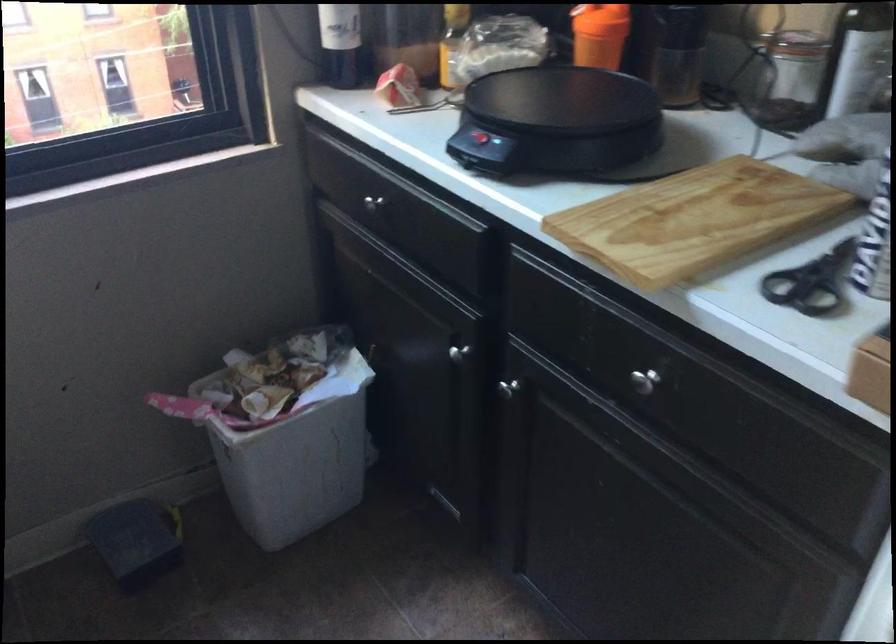
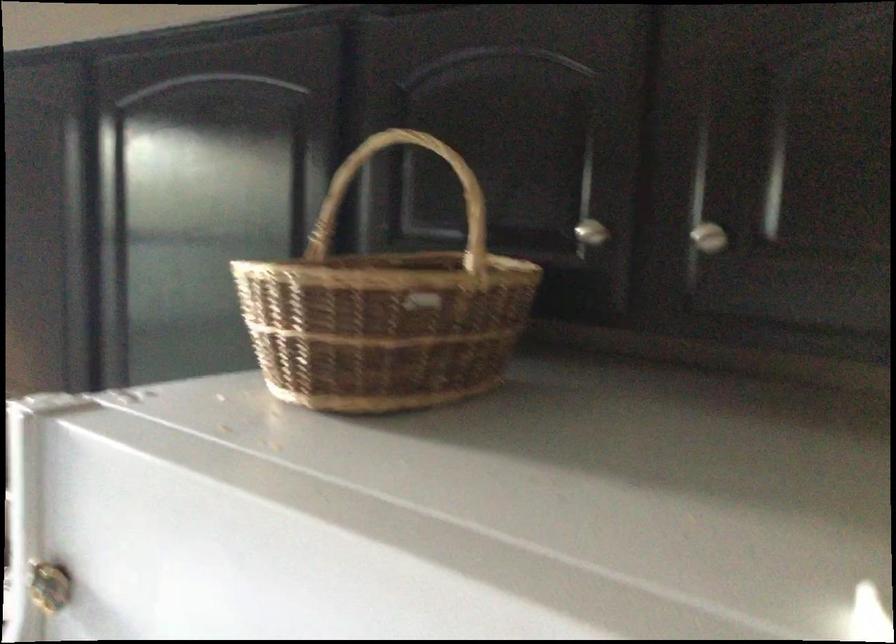
Question: I am providing you with two images of the same scene from different viewpoints. After the viewpoint changes to image2, which objects are now occluded?

Choices:
 (A) silver cabinet knob
 (B) white net hammock
 (C) orange shaker bottle
 (D) wicker basket handle

Answer: (C)